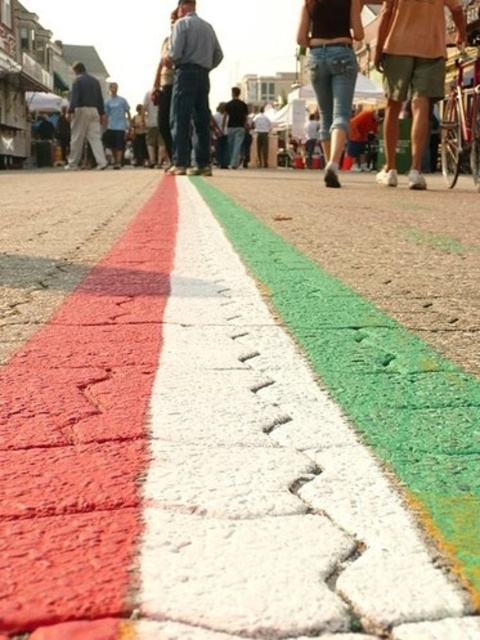
Question: Is jeans at center in front of dark blue jeans at center?

Choices:
 (A) yes
 (B) no

Answer: (A)

Question: Which point is closer to the camera?

Choices:
 (A) (322, 65)
 (B) (116, 83)
 (C) (408, 176)

Answer: (A)

Question: Is matte khaki shorts at center positioned at the back of matte gray pants at left?

Choices:
 (A) no
 (B) yes

Answer: (A)

Question: Which of the following is the closest to the observer?

Choices:
 (A) denim pants at center
 (B) matte khaki shorts at center

Answer: (B)

Question: Does matte gray pants at left appear on the left side of dark blue jeans at center?

Choices:
 (A) no
 (B) yes

Answer: (B)

Question: Based on their relative distances, which object is farther from the dark blue jeans at center?

Choices:
 (A) jeans at center
 (B) light blue shirt at center
 (C) denim pants at center

Answer: (A)